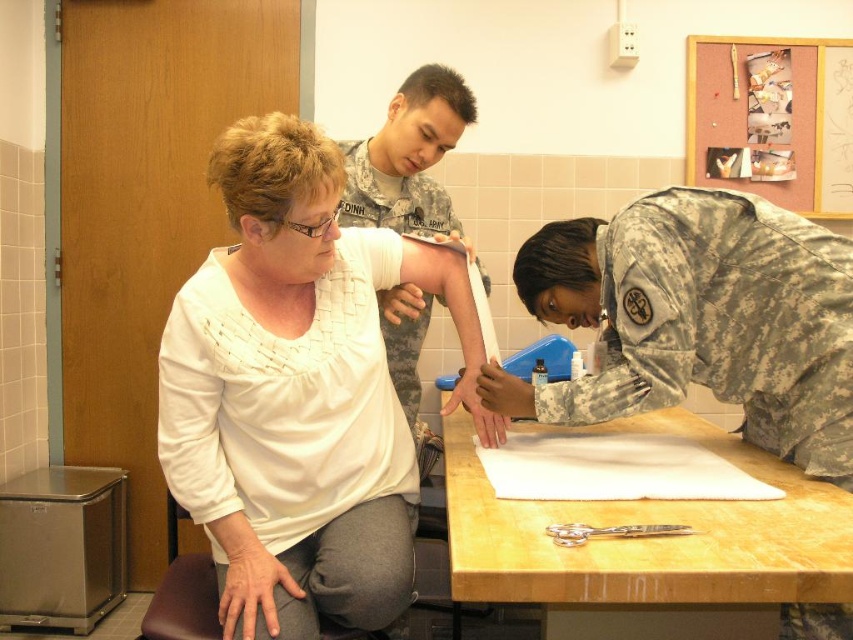
You are a drone operator viewing this scene from above. You need to report the exact position of the camouflage fabric uniform at lower right. What are its coordinates?

The camouflage fabric uniform at lower right is located at coordinates point (705, 317).

You are a photographer standing 5 feet away from the camera. You need to take a photo of the camouflage fabric uniform at lower right. Can you reach the camera to adjust it without moving from your current position?

The camouflage fabric uniform at lower right and camera are 4.49 feet apart from each other. Since you are standing 5 feet away from the camera, the distance between you and the camouflage fabric uniform at lower right would be 5 feet plus 4.49 feet, totaling approximately 9.49 feet. Therefore, you cannot reach the camera to adjust it without moving closer.

You are standing in the healthcare facility and need to reach a point marked at coordinates (711,240). If your arm is 0.7 meters long, can you comfortably reach that point without moving your position?

The point at coordinates (711,240) is 1.47 meters away from the viewer. Since your arm is only 0.7 meters long, you cannot comfortably reach that point without moving closer.